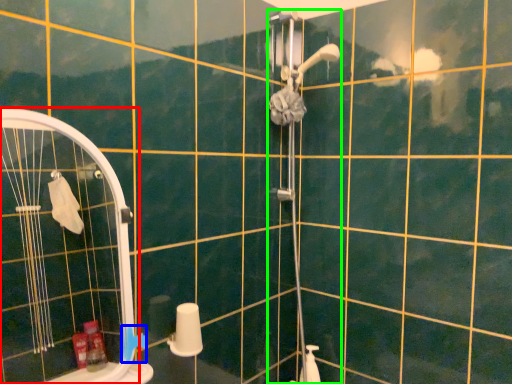
Question: Considering the real-world distances, which object is farthest from screen door (highlighted by a red box)? towel bar (highlighted by a blue box) or shower door (highlighted by a green box)?

Choices:
 (A) towel bar
 (B) shower door

Answer: (A)